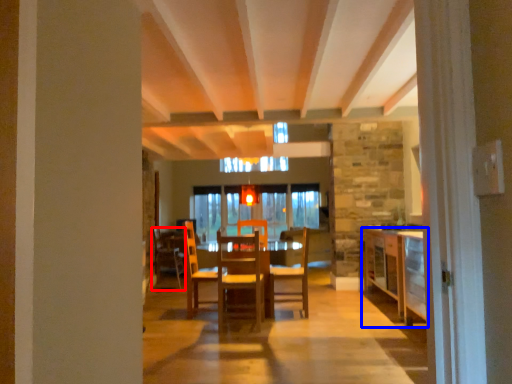
Question: Among these objects, which one is nearest to the camera, chair (highlighted by a red box) or cabinetry (highlighted by a blue box)?

Choices:
 (A) chair
 (B) cabinetry

Answer: (B)